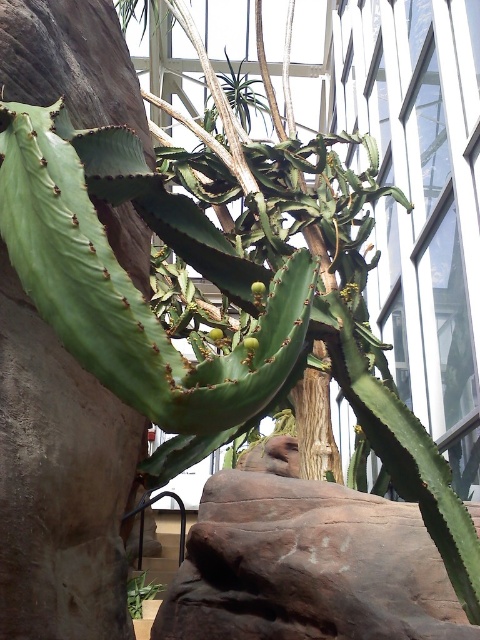
From the picture: You are a drone operator trying to capture a closeup of the succulent plant. You are currently positioned at point (268, 109) and want to move towards point (156, 593). Will moving in that direction take you closer to the camera or further away from it?

Moving from point (268, 109) to point (156, 593) will take you further away from the camera because point (268, 109) is closer to the camera than point (156, 593).

You are a horticulturist designing a display for a botanical exhibit. You have a brown rough rock at center and a green matte plant at lower left. Which object should you place higher on the display shelf to maintain their natural positioning?

The brown rough rock at center should be placed higher on the display shelf since it is taller than the green matte plant at lower left, mirroring their natural positioning.